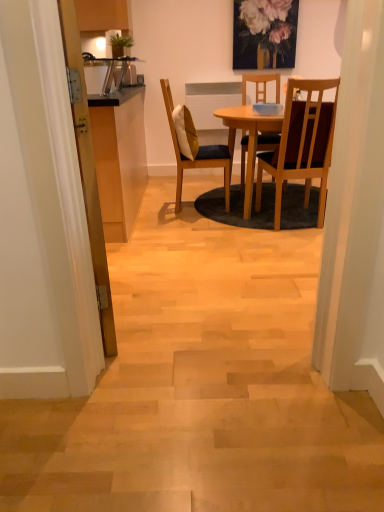
Question: From the image's perspective, relative to yellow fabric pillow at center, is wooden chair with cushion at center, the first chair when ordered from left to right, above or below?

Choices:
 (A) below
 (B) above

Answer: (A)

Question: From a real-world perspective, relative to yellow fabric pillow at center, is wooden chair with cushion at center, positioned as the second chair in right-to-left order, vertically above or below?

Choices:
 (A) below
 (B) above

Answer: (A)

Question: Which object is the closest to the light brown wooden table at center?

Choices:
 (A) brown wooden chair at center, marked as the second chair in a left-to-right arrangement
 (B) yellow fabric pillow at center
 (C) wooden door at left
 (D) wooden chair with cushion at center, the first chair when ordered from left to right

Answer: (D)

Question: Considering the real-world distances, which object is closest to the yellow fabric pillow at center?

Choices:
 (A) light brown wooden table at center
 (B) wooden door at left
 (C) wooden chair with cushion at center, the first chair when ordered from left to right
 (D) brown wooden chair at center, marked as the second chair in a left-to-right arrangement

Answer: (C)